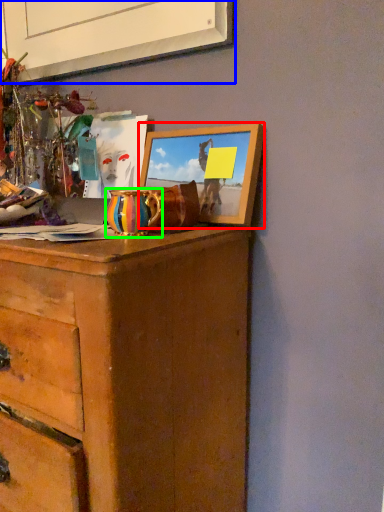
Question: Based on their relative distances, which object is farther from picture frame (highlighted by a red box)? Choose from picture frame (highlighted by a blue box) and vase (highlighted by a green box).

Choices:
 (A) picture frame
 (B) vase

Answer: (A)